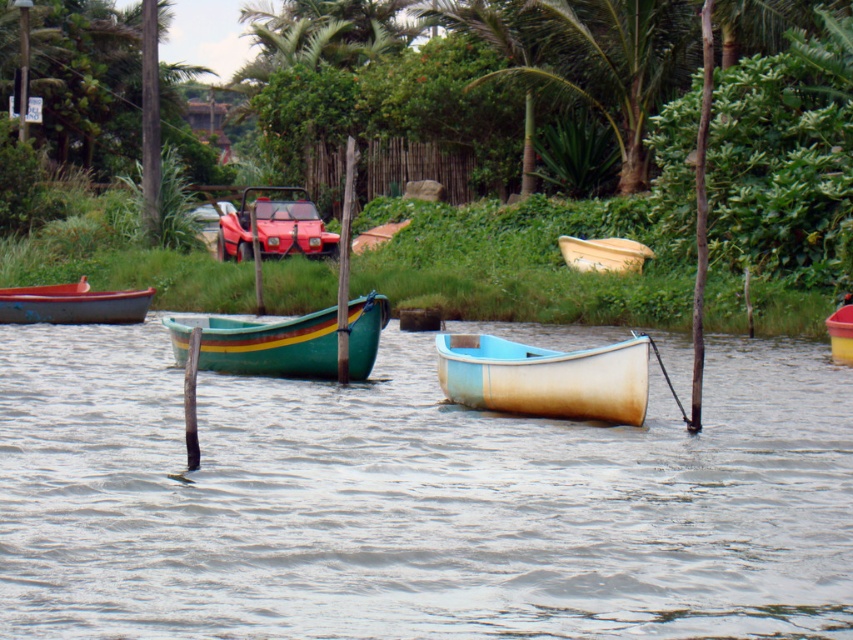
Question: Can you confirm if green painted wood canoe at center is positioned to the right of matte yellow boat at center?

Choices:
 (A) no
 (B) yes

Answer: (A)

Question: Does clear water at center appear on the left side of shiny red car at center?

Choices:
 (A) no
 (B) yes

Answer: (A)

Question: Is light blue wooden canoe at center positioned behind shiny red car at center?

Choices:
 (A) yes
 (B) no

Answer: (B)

Question: Which object is closer to the camera taking this photo?

Choices:
 (A) light blue wooden canoe at center
 (B) yellow matte canoe at center

Answer: (A)

Question: Which object appears closest to the camera in this image?

Choices:
 (A) shiny red car at center
 (B) matte red boat at left
 (C) light blue wooden canoe at center

Answer: (C)

Question: Which object appears closest to the camera in this image?

Choices:
 (A) wooden canoe at center
 (B) green painted wood canoe at center

Answer: (B)